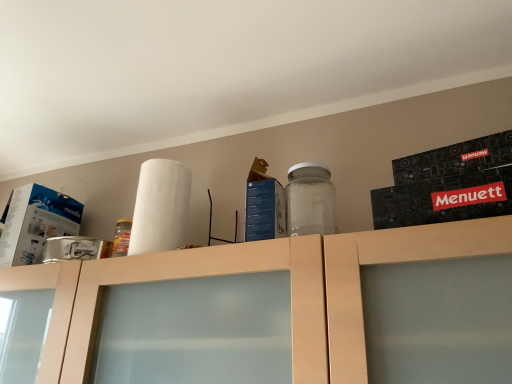
Question: Should I look upward or downward to see white matte paper towel at upper center?

Choices:
 (A) down
 (B) up

Answer: (A)

Question: Does white cardboard box at left, placed as the 1th box when sorted from back to front, have a smaller size compared to white matte paper towel at upper center?

Choices:
 (A) no
 (B) yes

Answer: (A)

Question: Is white cardboard box at left, the first box in the left-to-right sequence, to the left of white matte paper towel at upper center from the viewer's perspective?

Choices:
 (A) no
 (B) yes

Answer: (B)

Question: From a real-world perspective, is white cardboard box at left, the first box in the left-to-right sequence, located higher than white matte paper towel at upper center?

Choices:
 (A) yes
 (B) no

Answer: (B)

Question: Is white cardboard box at left, placed as the 1th box when sorted from back to front, looking in the opposite direction of white matte paper towel at upper center?

Choices:
 (A) no
 (B) yes

Answer: (A)

Question: Is white cardboard box at left, which appears as the 2th box when viewed from the front, not inside white matte paper towel at upper center?

Choices:
 (A) yes
 (B) no

Answer: (A)

Question: From the image's perspective, does white cardboard box at left, the first box in the left-to-right sequence, appear lower than white matte paper towel at upper center?

Choices:
 (A) no
 (B) yes

Answer: (B)

Question: Does white cardboard box at left, positioned as the second box in right-to-left order, appear on the right side of matte wood cabinet at upper center?

Choices:
 (A) no
 (B) yes

Answer: (A)

Question: Can you confirm if white cardboard box at left, placed as the 1th box when sorted from back to front, is taller than matte wood cabinet at upper center?

Choices:
 (A) no
 (B) yes

Answer: (A)

Question: Is white cardboard box at left, the first box in the left-to-right sequence, thinner than matte wood cabinet at upper center?

Choices:
 (A) no
 (B) yes

Answer: (B)

Question: From a real-world perspective, is white cardboard box at left, which appears as the 2th box when viewed from the front, located beneath matte wood cabinet at upper center?

Choices:
 (A) yes
 (B) no

Answer: (B)

Question: From the image's perspective, is white cardboard box at left, the first box in the left-to-right sequence, beneath matte wood cabinet at upper center?

Choices:
 (A) yes
 (B) no

Answer: (B)

Question: Could matte wood cabinet at upper center be considered to be inside white cardboard box at left, positioned as the second box in right-to-left order?

Choices:
 (A) no
 (B) yes

Answer: (A)

Question: Does blue cardboard box at center, which appears as the 2th box when viewed from the back, have a lesser width compared to matte wood cabinet at upper center?

Choices:
 (A) yes
 (B) no

Answer: (A)